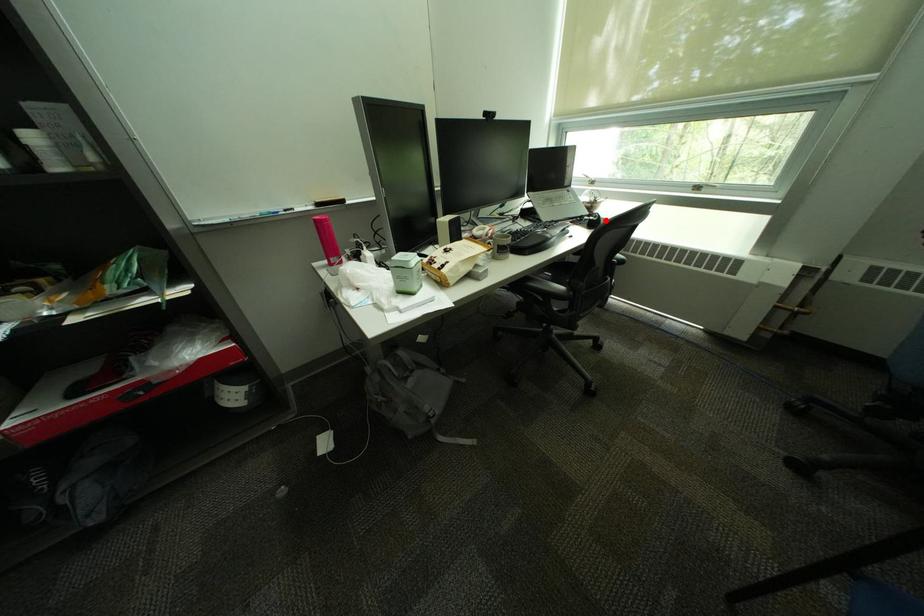
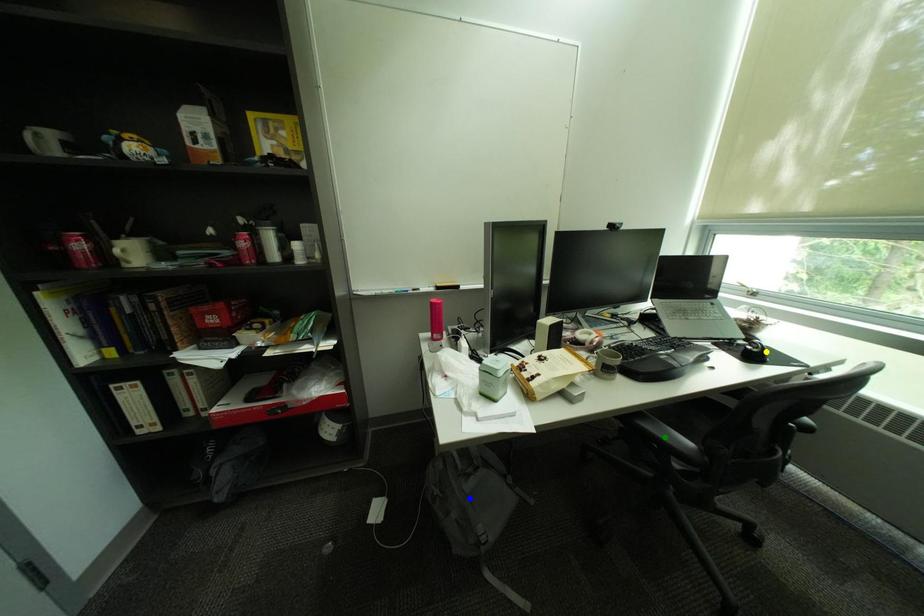
Question: I am providing you with two images of the same scene from different viewpoints. A red point is marked on the first image. You are given multiple points on the second image. Which point in image 2 is actually the same real-world point as the red point in image 1?

Choices:
 (A) blue point
 (B) green point
 (C) yellow point

Answer: (C)